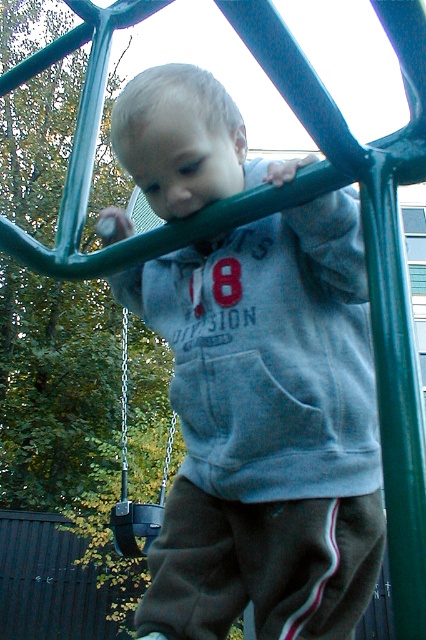
How much distance is there between gray fleece sweatshirt at center and black plastic swing at center?

gray fleece sweatshirt at center is 2.76 meters from black plastic swing at center.

Does gray fleece sweatshirt at center have a smaller size compared to black plastic swing at center?

Actually, gray fleece sweatshirt at center might be larger than black plastic swing at center.

I want to click on gray fleece sweatshirt at center, so click(x=267, y=428).